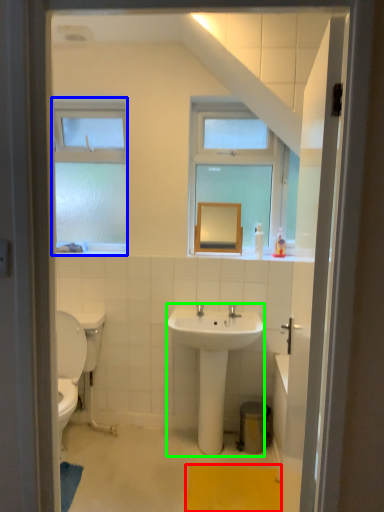
Question: Based on their relative distances, which object is nearer to bath mat (highlighted by a red box)? Choose from window (highlighted by a blue box) and sink (highlighted by a green box).

Choices:
 (A) window
 (B) sink

Answer: (B)